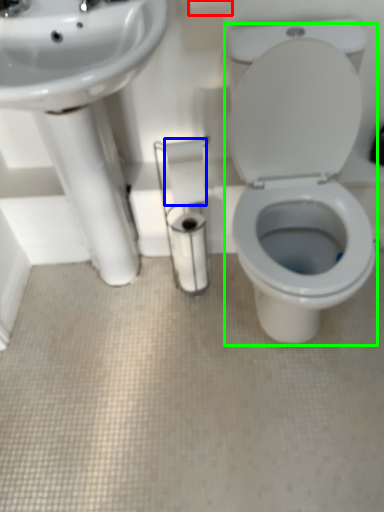
Question: Based on their relative distances, which object is nearer to toilet paper (highlighted by a red box)? Choose from toilet paper (highlighted by a blue box) and porcelain (highlighted by a green box).

Choices:
 (A) toilet paper
 (B) porcelain

Answer: (A)